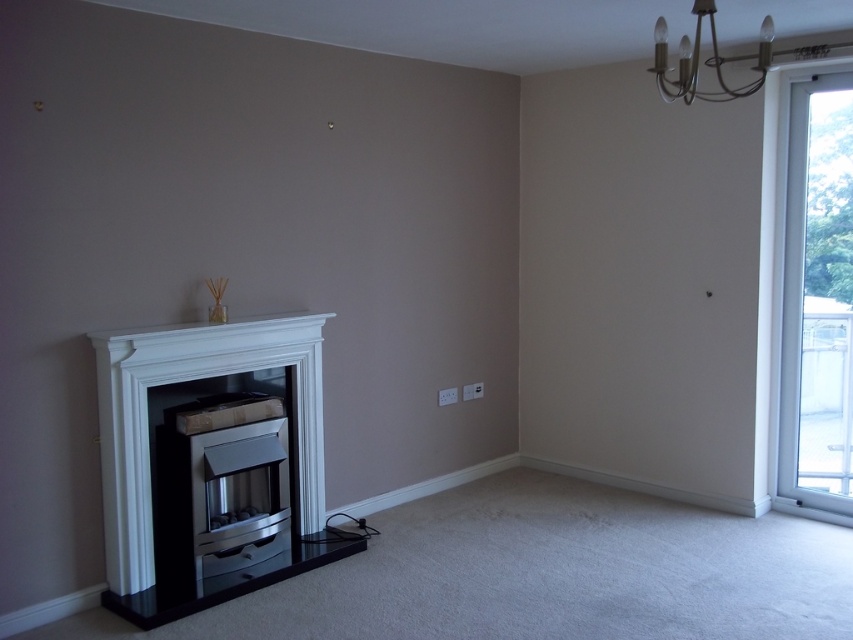
Can you confirm if clear glass window at right is positioned to the right of metallic chandelier at upper right?

Indeed, clear glass window at right is positioned on the right side of metallic chandelier at upper right.

Does clear glass window at right appear under metallic chandelier at upper right?

Yes.

Describe the element at coordinates (810, 320) in the screenshot. I see `clear glass window at right` at that location.

I want to click on clear glass window at right, so click(810, 320).

Who is lower down, white glossy fireplace at left or clear glass window at right?

white glossy fireplace at left is lower down.

Where is `white glossy fireplace at left`? The width and height of the screenshot is (853, 640). white glossy fireplace at left is located at coordinates (210, 461).

Between point (234, 444) and point (780, 140), which one is positioned behind?

Point (780, 140)

Find the location of a particular element. white glossy fireplace at left is located at coordinates (210, 461).

Who is more distant from viewer, (231,442) or (665,52)?

The point (231,442) is behind.

Where is `white glossy fireplace at left`? white glossy fireplace at left is located at coordinates pos(210,461).